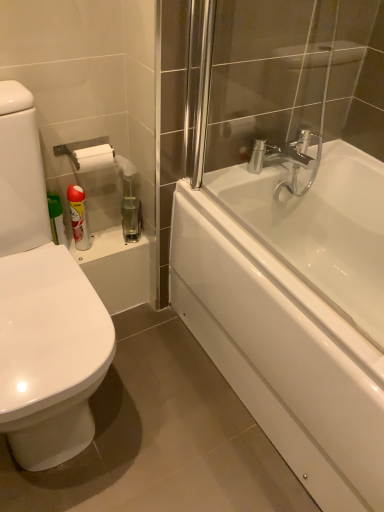
Identify the location of vacant space situated on the left part of translucent plastic spray bottle at upper left. Image resolution: width=384 pixels, height=512 pixels. (105, 237).